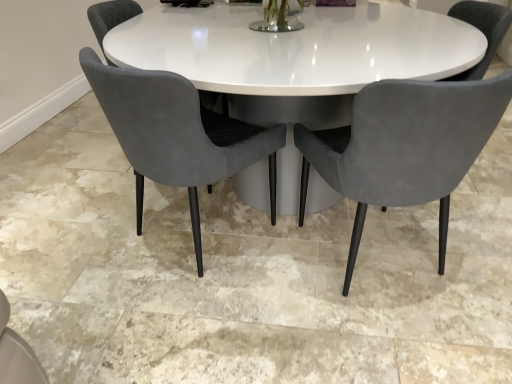
The image size is (512, 384). Identify the location of vacant space in front of velvet grey chair at center, arranged as the 3th chair when viewed from the right. (111, 210).